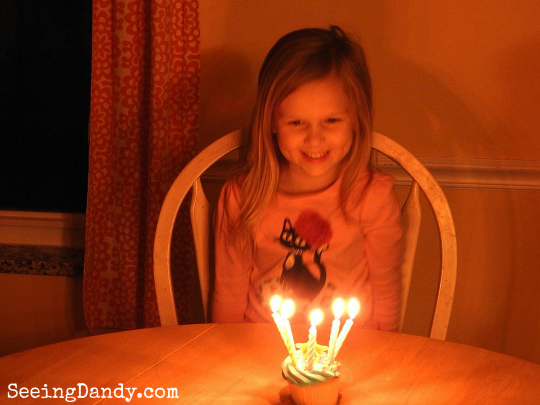
Identify the location of wall. (467, 83).